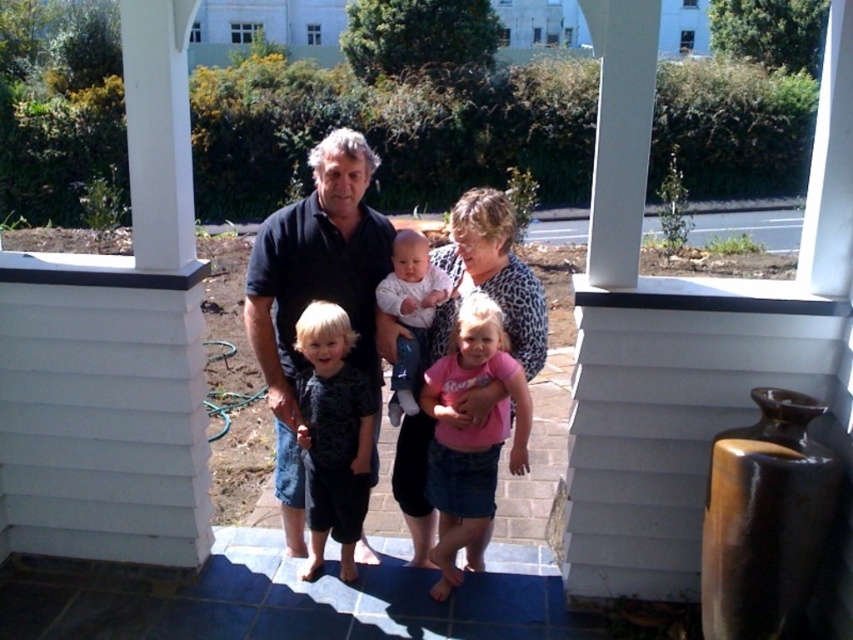
Question: Is matte black shirt at center positioned in front of dark gray textured shirt at center?

Choices:
 (A) yes
 (B) no

Answer: (B)

Question: Is black cotton shirt at center further to camera compared to dark gray textured shirt at center?

Choices:
 (A) no
 (B) yes

Answer: (B)

Question: Among these points, which one is nearest to the camera?

Choices:
 (A) (244, 301)
 (B) (338, 339)

Answer: (B)

Question: Is matte black shirt at center positioned before white cotton baby at center?

Choices:
 (A) yes
 (B) no

Answer: (A)

Question: Estimate the real-world distances between objects in this image. Which object is closer to the pink denim skirt at center?

Choices:
 (A) matte black shirt at center
 (B) white cotton baby at center

Answer: (A)

Question: Which object is positioned farthest from the white cotton baby at center?

Choices:
 (A) pink denim skirt at center
 (B) black cotton shirt at center
 (C) dark gray textured shirt at center
 (D) matte black shirt at center

Answer: (C)